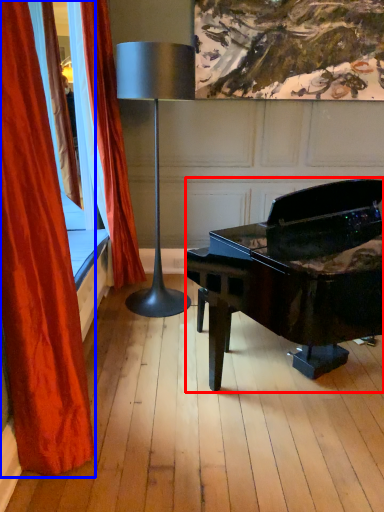
Question: Which point is closer to the camera, piano (highlighted by a red box) or curtain (highlighted by a blue box)?

Choices:
 (A) piano
 (B) curtain

Answer: (A)